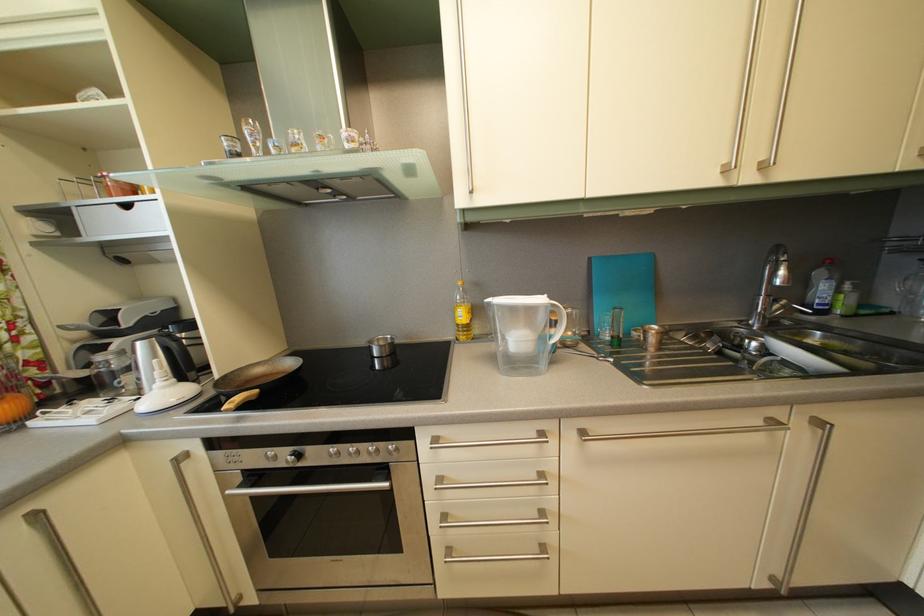
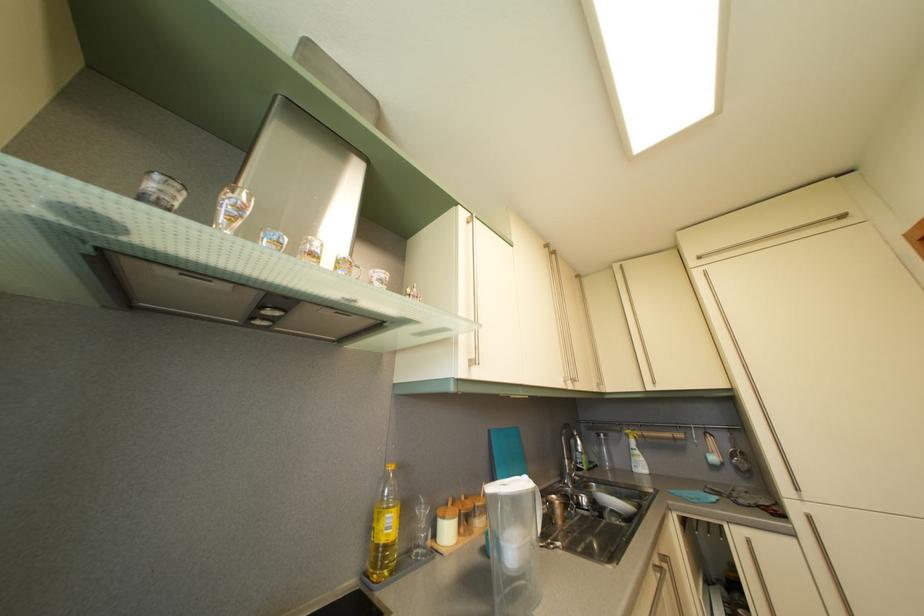
Locate, in the second image, the point that corresponds to point (470, 323) in the first image.

(396, 533)